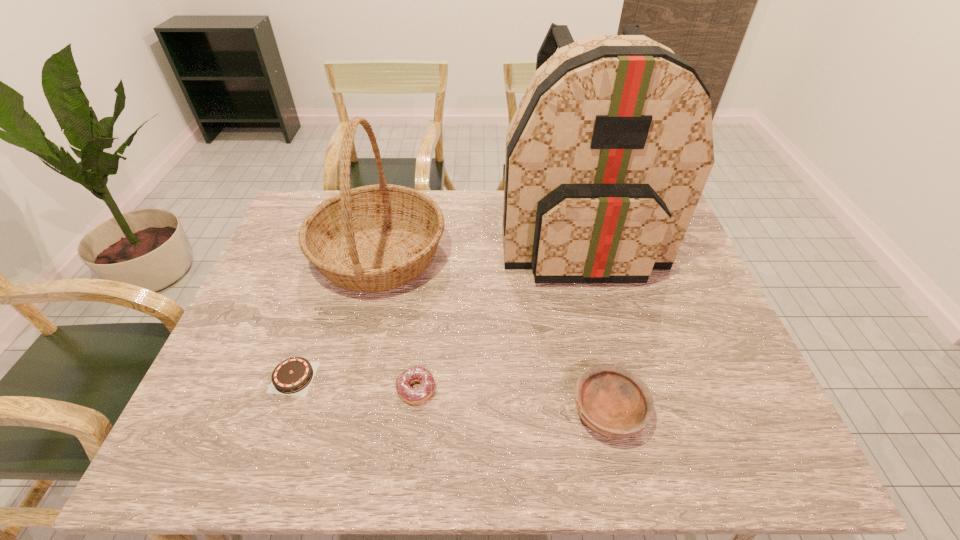
Where is `vacant area that lies between the shortest object and the bowl`? The width and height of the screenshot is (960, 540). vacant area that lies between the shortest object and the bowl is located at coordinates (451, 395).

Find the location of a particular element. The width and height of the screenshot is (960, 540). free spot between the doughnut and the tallest object is located at coordinates (497, 312).

Locate which object is the closest to the fourth shortest object. Please provide its 2D coordinates. Your answer should be formatted as a tuple, i.e. [(x, y)], where the tuple contains the x and y coordinates of a point satisfying the conditions above.

[(293, 376)]

Choose which object is the fourth nearest neighbor to the basket. Please provide its 2D coordinates. Your answer should be formatted as a tuple, i.e. [(x, y)], where the tuple contains the x and y coordinates of a point satisfying the conditions above.

[(612, 401)]